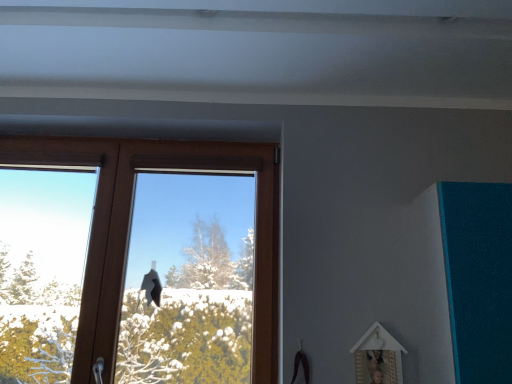
Question: Looking at their shapes, would you say wooden picture frame at lower right is wider or thinner than brown wooden window at center?

Choices:
 (A) thin
 (B) wide

Answer: (A)

Question: Is wooden picture frame at lower right spatially inside brown wooden window at center, or outside of it?

Choices:
 (A) inside
 (B) outside

Answer: (B)

Question: In the image, is wooden picture frame at lower right positioned in front of or behind brown wooden window at center?

Choices:
 (A) behind
 (B) front

Answer: (B)

Question: Does point (270, 326) appear closer or farther from the camera than point (376, 357)?

Choices:
 (A) farther
 (B) closer

Answer: (A)

Question: Is brown wooden window at center taller or shorter than wooden picture frame at lower right?

Choices:
 (A) short
 (B) tall

Answer: (B)

Question: From a real-world perspective, is brown wooden window at center positioned above or below wooden picture frame at lower right?

Choices:
 (A) above
 (B) below

Answer: (A)

Question: Considering the positions of brown wooden window at center and wooden picture frame at lower right in the image, is brown wooden window at center wider or thinner than wooden picture frame at lower right?

Choices:
 (A) wide
 (B) thin

Answer: (A)